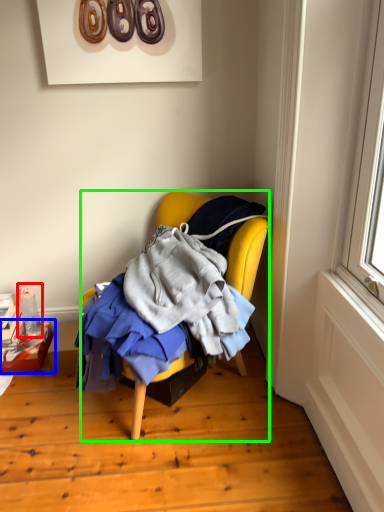
Question: Which object is positioned farthest from bottle (highlighted by a red box)? Select from box (highlighted by a blue box) and chair (highlighted by a green box).

Choices:
 (A) box
 (B) chair

Answer: (B)